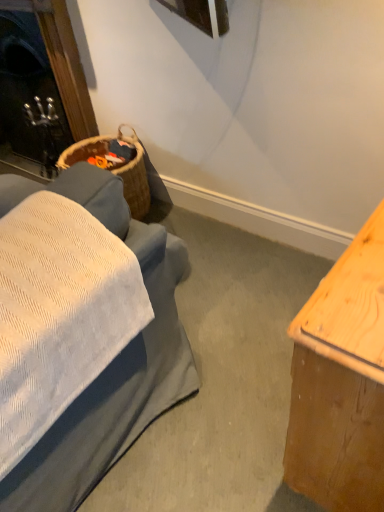
Question: Would you say light brown wood table at right is to the left or to the right of black glass fireplace at upper left in the picture?

Choices:
 (A) right
 (B) left

Answer: (A)

Question: Relative to black glass fireplace at upper left, is light brown wood table at right in front or behind?

Choices:
 (A) behind
 (B) front

Answer: (B)

Question: Is light brown wood table at right wider or thinner than black glass fireplace at upper left?

Choices:
 (A) wide
 (B) thin

Answer: (A)

Question: Is black glass fireplace at upper left bigger or smaller than light brown wood table at right?

Choices:
 (A) small
 (B) big

Answer: (B)

Question: Considering their positions, is black glass fireplace at upper left located in front of or behind light brown wood table at right?

Choices:
 (A) behind
 (B) front

Answer: (A)

Question: Considering the positions of black glass fireplace at upper left and light brown wood table at right in the image, is black glass fireplace at upper left wider or thinner than light brown wood table at right?

Choices:
 (A) wide
 (B) thin

Answer: (B)

Question: From the image's perspective, is black glass fireplace at upper left located above or below light brown wood table at right?

Choices:
 (A) below
 (B) above

Answer: (B)